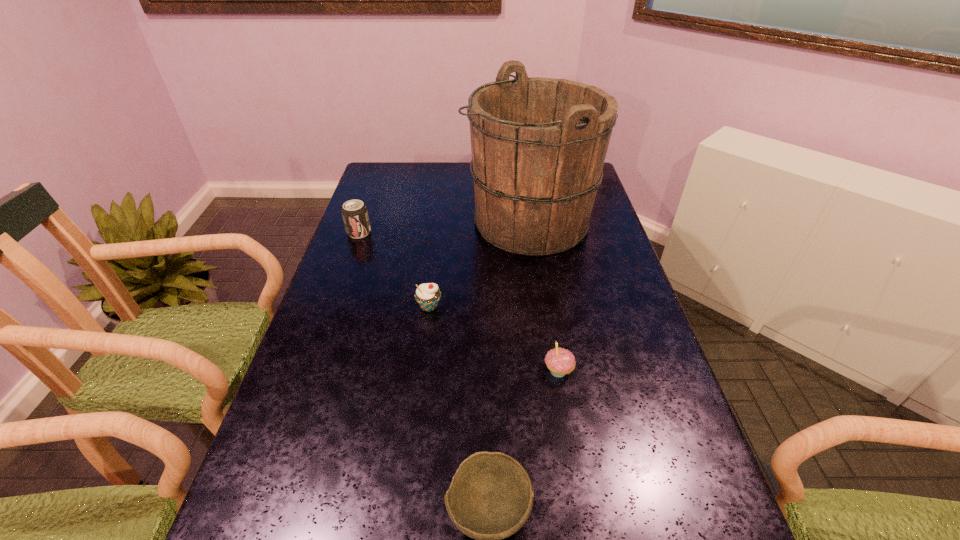
Find the location of a particular element. The width and height of the screenshot is (960, 540). the tallest object is located at coordinates (538, 145).

The width and height of the screenshot is (960, 540). I want to click on the leftmost object, so click(355, 215).

Locate an element on the screen. This screenshot has width=960, height=540. the third nearest object is located at coordinates (427, 295).

Image resolution: width=960 pixels, height=540 pixels. I want to click on the left cupcake, so click(427, 295).

Find the location of a particular element. the fourth farthest object is located at coordinates (560, 361).

You are a GUI agent. You are given a task and a screenshot of the screen. Output one action in this format:
    pyautogui.click(x=<x>, y=<y>)
    Task: Click on the nearer cupcake
    Image resolution: width=960 pixels, height=540 pixels.
    Given the screenshot: What is the action you would take?
    pyautogui.click(x=560, y=361)

The height and width of the screenshot is (540, 960). I want to click on vacant area situated 0.110m on the front of the bucket, so click(x=538, y=286).

Where is `free location located 0.400m on the right of the soda can`? This screenshot has width=960, height=540. free location located 0.400m on the right of the soda can is located at coordinates (492, 232).

This screenshot has height=540, width=960. What are the coordinates of `vacant space located 0.230m on the right of the left cupcake` in the screenshot? It's located at (527, 307).

The height and width of the screenshot is (540, 960). Find the location of `free space located on the back of the second nearest object`. free space located on the back of the second nearest object is located at coordinates pos(540,262).